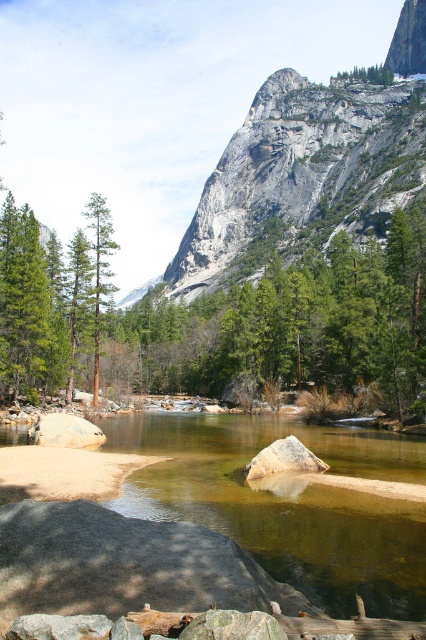
Which is below, clear water at center or smooth gray rock at lower left?

clear water at center is below.

Does point (397, 570) come closer to viewer compared to point (62, 442)?

Yes, it is in front of point (62, 442).

Locate an element on the screen. The image size is (426, 640). clear water at center is located at coordinates (287, 502).

At what (x,y) coordinates should I click in order to perform the action: click on green leafy tree at center. Please return your answer as a coordinate pair (x, y). The height and width of the screenshot is (640, 426). Looking at the image, I should click on (299, 323).

Is green leafy tree at center taller than green matte tree at center-left?

Correct, green leafy tree at center is much taller as green matte tree at center-left.

Does point (420, 353) lie in front of point (86, 204)?

Yes, it is.

You are a GUI agent. You are given a task and a screenshot of the screen. Output one action in this format:
    pyautogui.click(x=<x>, y=<y>)
    Task: Click on the green leafy tree at center
    
    Given the screenshot: What is the action you would take?
    pyautogui.click(x=299, y=323)

From the picture: Which is more to the right, gray rock mountain at upper center or gray rough boulder at center?

gray rock mountain at upper center is more to the right.

Looking at this image, how far apart are gray rock mountain at upper center and gray rough boulder at center?

gray rock mountain at upper center is 475.87 feet away from gray rough boulder at center.

At what (x,y) coordinates should I click in order to perform the action: click on gray rock mountain at upper center. Please return your answer as a coordinate pair (x, y). This screenshot has width=426, height=640. Looking at the image, I should click on (308, 164).